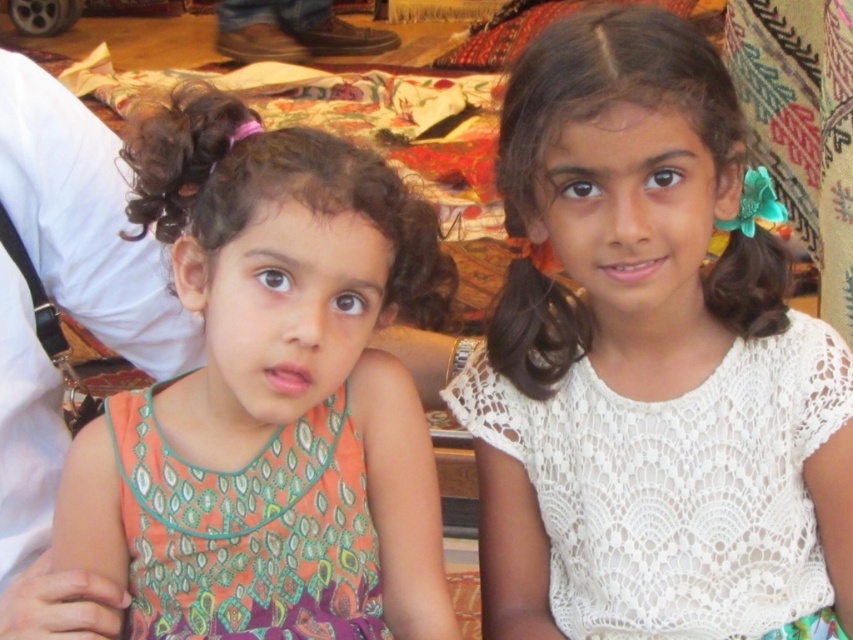
Question: Does orange printed dress at left appear on the right side of white lace dress at center?

Choices:
 (A) no
 (B) yes

Answer: (A)

Question: Which is nearer to the white lace dress at center?

Choices:
 (A) orange printed dress at left
 (B) printed fabric dress at left

Answer: (A)

Question: Which point is farther to the camera?

Choices:
 (A) white lace dress at center
 (B) orange printed dress at left

Answer: (A)

Question: Does white lace dress at center appear on the right side of printed fabric dress at left?

Choices:
 (A) no
 (B) yes

Answer: (B)

Question: Estimate the real-world distances between objects in this image. Which object is farther from the printed fabric dress at left?

Choices:
 (A) orange printed dress at left
 (B) white lace dress at center

Answer: (B)

Question: Does orange printed dress at left lie behind printed fabric dress at left?

Choices:
 (A) yes
 (B) no

Answer: (B)